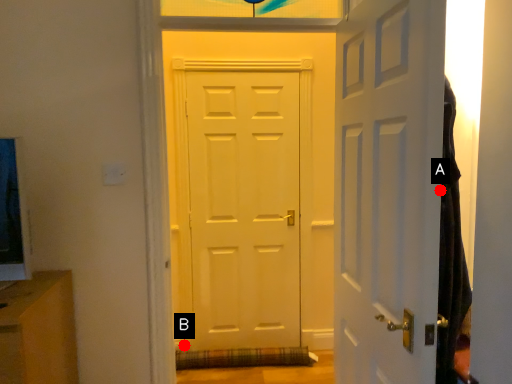
Question: Two points are circled on the image, labeled by A and B beside each circle. Which point is closer to the camera?

Choices:
 (A) A is closer
 (B) B is closer

Answer: (A)